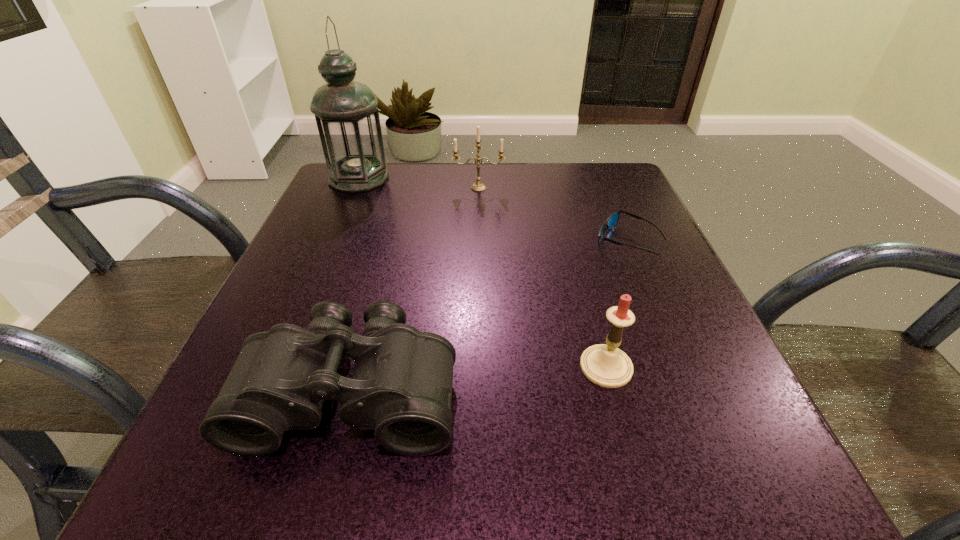
Select which object is the third closest to the farther candle. Please provide its 2D coordinates. Your answer should be formatted as a tuple, i.e. [(x, y)], where the tuple contains the x and y coordinates of a point satisfying the conditions above.

[(401, 386)]